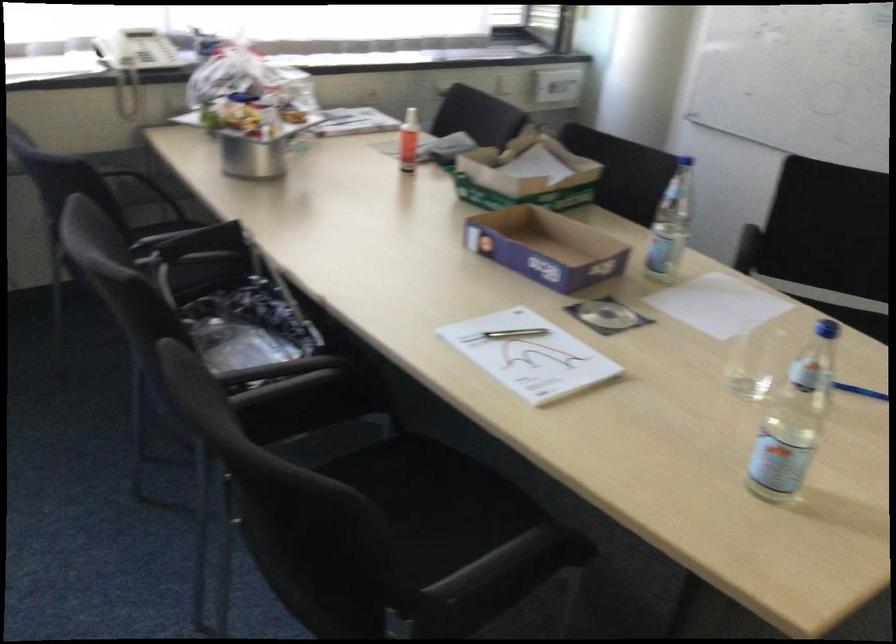
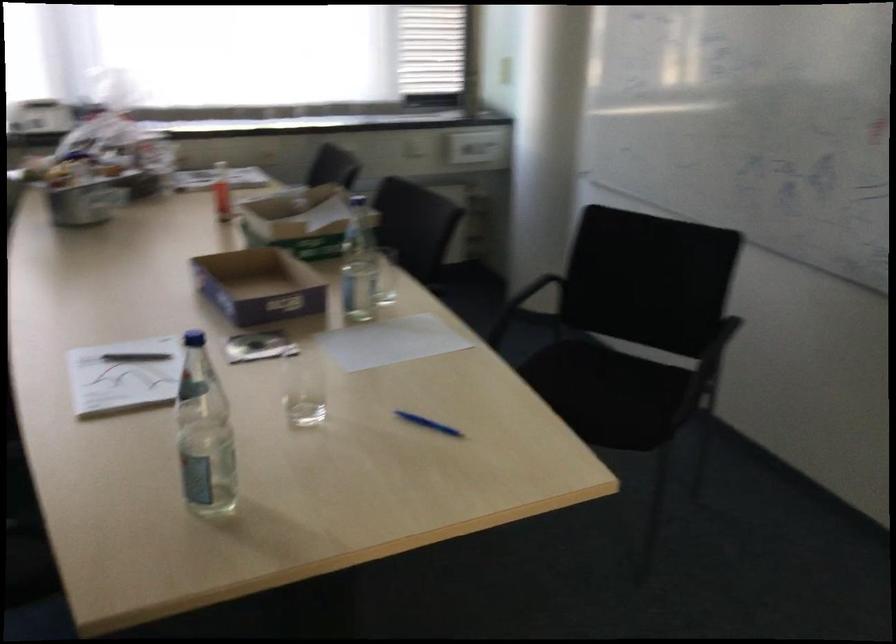
Question: What movement of the cameraman would produce the second image?

Choices:
 (A) Left
 (B) Right
 (C) Forward
 (D) Backward

Answer: (B)